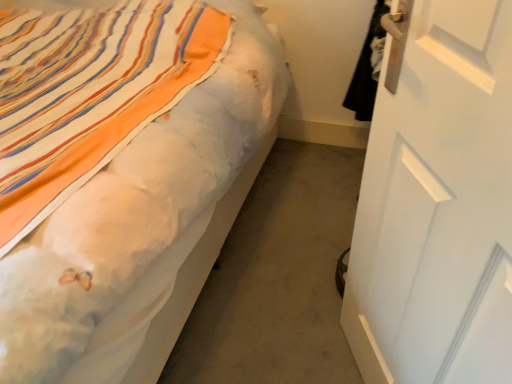
Question: Is matte white bed at center wider or thinner than white matte door at right?

Choices:
 (A) wide
 (B) thin

Answer: (A)

Question: Considering the positions of matte white bed at center and white matte door at right in the image, is matte white bed at center bigger or smaller than white matte door at right?

Choices:
 (A) small
 (B) big

Answer: (B)

Question: In the image, is matte white bed at center positioned in front of or behind white matte door at right?

Choices:
 (A) front
 (B) behind

Answer: (B)

Question: From a real-world perspective, relative to matte white bed at center, is white matte door at right vertically above or below?

Choices:
 (A) below
 (B) above

Answer: (B)

Question: From their relative heights in the image, would you say white matte door at right is taller or shorter than matte white bed at center?

Choices:
 (A) tall
 (B) short

Answer: (A)

Question: In the image, is white matte door at right positioned in front of or behind matte white bed at center?

Choices:
 (A) behind
 (B) front

Answer: (B)

Question: From the image's perspective, is white matte door at right located above or below matte white bed at center?

Choices:
 (A) below
 (B) above

Answer: (A)